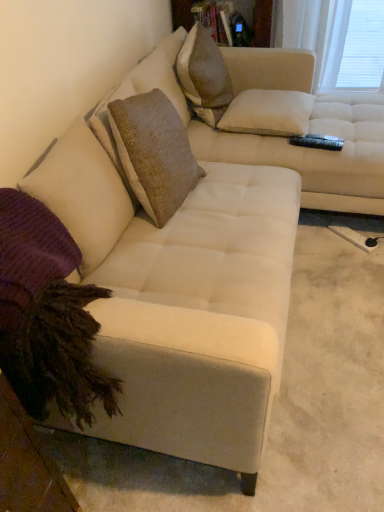
What do you see at coordinates (268, 113) in the screenshot? I see `white textured pillow at upper center, the second pillow viewed from the left` at bounding box center [268, 113].

The width and height of the screenshot is (384, 512). Describe the element at coordinates (30, 253) in the screenshot. I see `purple knitted pillow at lower left, which is the first pillow from bottom to top` at that location.

You are a GUI agent. You are given a task and a screenshot of the screen. Output one action in this format:
    pyautogui.click(x=<x>, y=<y>)
    Task: Click on the textured beige pillow at upper center
    
    Given the screenshot: What is the action you would take?
    [x=204, y=75]

Where is `white textured pillow at upper center, acting as the second pillow starting from the front`? white textured pillow at upper center, acting as the second pillow starting from the front is located at coordinates (268, 113).

This screenshot has height=512, width=384. I want to click on window screen to the right of purple knitted pillow at lower left, which appears as the 2th pillow when viewed from the back, so (363, 46).

Is point (37, 200) farther from camera compared to point (363, 87)?

No, it is in front of (363, 87).

Does purple knitted pillow at lower left, which is the first pillow in front-to-back order, contain white matte window screen at upper right?

No.

Who is bigger, white matte window screen at upper right or textured beige pillow at upper center?

textured beige pillow at upper center.

Is white matte window screen at upper right inside the boundaries of textured beige pillow at upper center, or outside?

The correct answer is: outside.

Is purple knitted pillow at lower left, which appears as the 2th pillow when viewed from the back, to the right of white textured pillow at upper center, placed as the first pillow when sorted from right to left, from the viewer's perspective?

No.

Considering the sizes of objects purple knitted pillow at lower left, which is the first pillow from bottom to top, and white textured pillow at upper center, marked as the first pillow in a top-to-bottom arrangement, in the image provided, who is thinner, purple knitted pillow at lower left, which is the first pillow from bottom to top, or white textured pillow at upper center, marked as the first pillow in a top-to-bottom arrangement,?

Thinner between the two is purple knitted pillow at lower left, which is the first pillow from bottom to top.

This screenshot has width=384, height=512. In order to click on pillow in front of the white textured pillow at upper center, the second pillow viewed from the left in this screenshot , I will do `click(30, 253)`.

Which of these two, purple knitted pillow at lower left, the second pillow from the top, or white textured pillow at upper center, acting as the second pillow starting from the front, stands taller?

purple knitted pillow at lower left, the second pillow from the top, is taller.

In the scene shown: From the image's perspective, is purple knitted pillow at lower left, which appears as the 2th pillow when viewed from the back, under textured beige pillow at upper center?

Yes.

Is point (43, 248) positioned in front of point (209, 89)?

Yes, it is in front of point (209, 89).

Is textured beige pillow at upper center at the back of purple knitted pillow at lower left, arranged as the 2th pillow when viewed from the right?

No, purple knitted pillow at lower left, arranged as the 2th pillow when viewed from the right, is not facing the opposite direction of textured beige pillow at upper center.

What are the coordinates of `window screen behind the white textured pillow at upper center, placed as the first pillow when sorted from right to left` in the screenshot? It's located at (363, 46).

Is the surface of white matte window screen at upper right in direct contact with white textured pillow at upper center, marked as the first pillow in a top-to-bottom arrangement?

white matte window screen at upper right and white textured pillow at upper center, marked as the first pillow in a top-to-bottom arrangement, are not in contact.

Considering the points (372, 28) and (265, 129), which point is behind, point (372, 28) or point (265, 129)?

Point (372, 28)

Is textured beige pillow at upper center positioned with its back to white textured pillow at upper center, placed as the first pillow when sorted from right to left?

textured beige pillow at upper center does not have its back to white textured pillow at upper center, placed as the first pillow when sorted from right to left.

Looking at this image, from the image's perspective, who appears lower, textured beige pillow at upper center or white textured pillow at upper center, the second pillow viewed from the left?

white textured pillow at upper center, the second pillow viewed from the left, is shown below in the image.

Which of these two, textured beige pillow at upper center or white textured pillow at upper center, acting as the second pillow starting from the front, is thinner?

textured beige pillow at upper center.

Is point (220, 110) closer to camera compared to point (310, 102)?

Yes, it is.

Is white textured pillow at upper center, placed as the first pillow when sorted from right to left, positioned in front of white matte window screen at upper right?

That is True.

Between white textured pillow at upper center, acting as the second pillow starting from the front, and white matte window screen at upper right, which one has larger width?

white textured pillow at upper center, acting as the second pillow starting from the front, is wider.

Consider the image. From the image's perspective, is white textured pillow at upper center, the second pillow in the bottom-to-top sequence, below white matte window screen at upper right?

Yes, from the image's perspective, white textured pillow at upper center, the second pillow in the bottom-to-top sequence, is beneath white matte window screen at upper right.

What's the angular difference between white textured pillow at upper center, the second pillow in the bottom-to-top sequence, and white matte window screen at upper right's facing directions?

They differ by 81.8 degrees in their facing directions.

Locate an element on the screen. Image resolution: width=384 pixels, height=512 pixels. window screen behind the purple knitted pillow at lower left, which is the first pillow from bottom to top is located at coordinates (363, 46).

Find the location of `window screen on the right of textured beige pillow at upper center`. window screen on the right of textured beige pillow at upper center is located at coordinates (363, 46).

Looking at the image, which one is located closer to purple knitted pillow at lower left, which is the first pillow from bottom to top, white textured pillow at upper center, the second pillow in the bottom-to-top sequence, or textured beige pillow at upper center?

textured beige pillow at upper center lies closer to purple knitted pillow at lower left, which is the first pillow from bottom to top, than the other object.

Estimate the real-world distances between objects in this image. Which object is closer to textured beige pillow at upper center, white matte window screen at upper right or purple knitted pillow at lower left, which appears as the 2th pillow when viewed from the back?

The object closer to textured beige pillow at upper center is purple knitted pillow at lower left, which appears as the 2th pillow when viewed from the back.

Which object lies further to the anchor point textured beige pillow at upper center, purple knitted pillow at lower left, which is the first pillow from bottom to top, or white textured pillow at upper center, the second pillow in the bottom-to-top sequence?

Based on the image, purple knitted pillow at lower left, which is the first pillow from bottom to top, appears to be further to textured beige pillow at upper center.

Which object lies further to the anchor point white matte window screen at upper right, textured beige pillow at upper center or purple knitted pillow at lower left, which is the first pillow in front-to-back order?

purple knitted pillow at lower left, which is the first pillow in front-to-back order.

Considering their positions, is white textured pillow at upper center, the second pillow in the bottom-to-top sequence, positioned further to textured beige pillow at upper center than white matte window screen at upper right?

Based on the image, white matte window screen at upper right appears to be further to textured beige pillow at upper center.

Based on their spatial positions, is purple knitted pillow at lower left, arranged as the 2th pillow when viewed from the right, or white matte window screen at upper right further from textured beige pillow at upper center?

white matte window screen at upper right.

Looking at the image, which one is located further to white textured pillow at upper center, marked as the first pillow in a top-to-bottom arrangement, white matte window screen at upper right or textured beige pillow at upper center?

white matte window screen at upper right.

From the picture: When comparing their distances from white matte window screen at upper right, does white textured pillow at upper center, acting as the second pillow starting from the front, or purple knitted pillow at lower left, marked as the first pillow in a left-to-right arrangement, seem further?

purple knitted pillow at lower left, marked as the first pillow in a left-to-right arrangement, is further to white matte window screen at upper right.

The height and width of the screenshot is (512, 384). What are the coordinates of `throw pillow between purple knitted pillow at lower left, marked as the first pillow in a left-to-right arrangement, and white matte window screen at upper right from front to back` in the screenshot? It's located at (204, 75).

Locate an element on the screen. Image resolution: width=384 pixels, height=512 pixels. throw pillow positioned between purple knitted pillow at lower left, which appears as the 2th pillow when viewed from the back, and white textured pillow at upper center, the second pillow viewed from the left, from near to far is located at coordinates (204, 75).

You are a GUI agent. You are given a task and a screenshot of the screen. Output one action in this format:
    pyautogui.click(x=<x>, y=<y>)
    Task: Click on the pillow between purple knitted pillow at lower left, arranged as the 2th pillow when viewed from the right, and white matte window screen at upper right, along the z-axis
    The width and height of the screenshot is (384, 512).
    Given the screenshot: What is the action you would take?
    pyautogui.click(x=268, y=113)

Where is `pillow situated between textured beige pillow at upper center and white matte window screen at upper right from left to right`? This screenshot has width=384, height=512. pillow situated between textured beige pillow at upper center and white matte window screen at upper right from left to right is located at coordinates (268, 113).